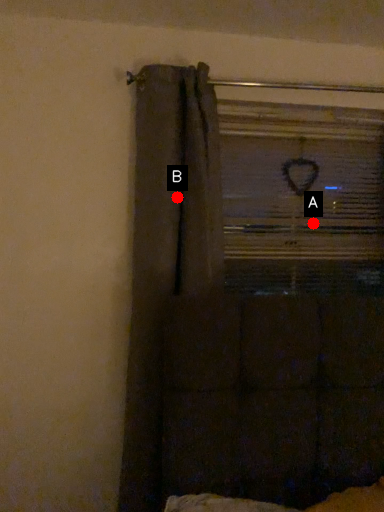
Question: Two points are circled on the image, labeled by A and B beside each circle. Which point is farther from the camera taking this photo?

Choices:
 (A) A is further
 (B) B is further

Answer: (A)